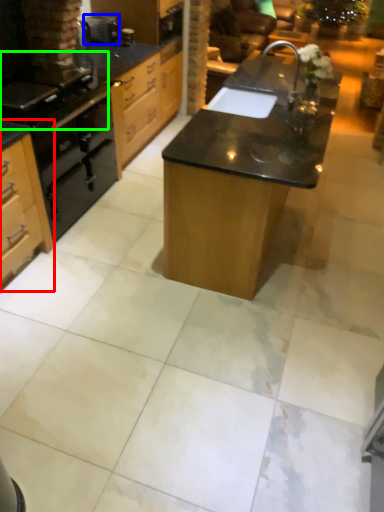
Question: Estimate the real-world distances between objects in this image. Which object is closer to cabinetry (highlighted by a red box), appliance (highlighted by a blue box) or gas stove (highlighted by a green box)?

Choices:
 (A) appliance
 (B) gas stove

Answer: (B)